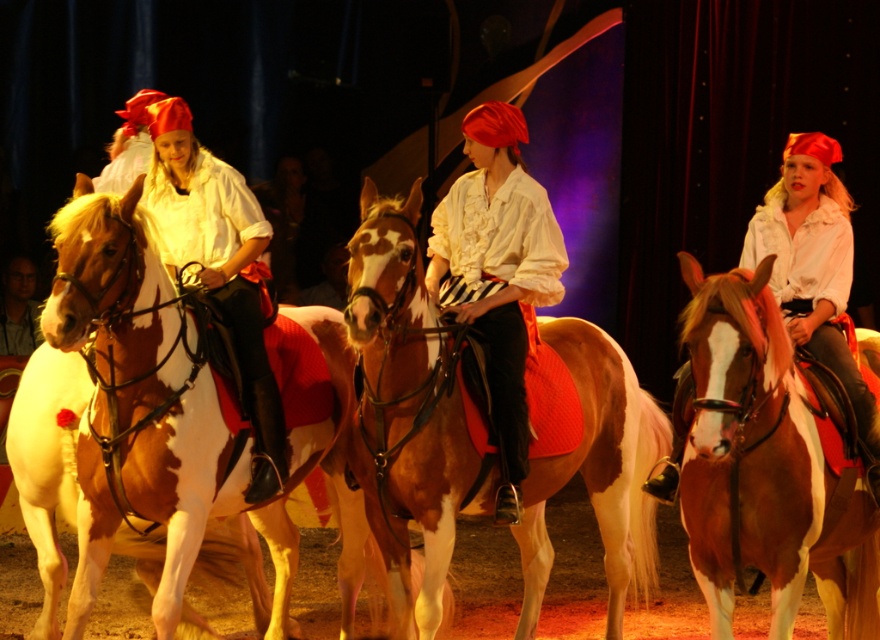
You are a stagehand observing the performance. You need to adjust the spotlight so it shines on the matte white shirt at center without illuminating the brown speckled horse at center. Based on their positions, is this possible?

The brown speckled horse at center is in front of the matte white shirt at center. Therefore, adjusting the spotlight to shine on the matte white shirt at center without illuminating the brown speckled horse at center would not be possible because the horse is blocking the direct line of light to the shirt.

You are a stagehand standing behind the dark curtains on the left side of the stage. You need to lead the brown and white speckled horse at center to the exit located behind the curtains. The horse is currently 3.98 meters away from you. Can you safely walk towards the horse without needing to move any other riders or horses first?

The brown and white speckled horse at center is 3.98 meters away from the viewer. Since you are a stagehand and the distance is sufficient, you can safely walk towards the horse without needing to move other riders or horses first.

You are designing a stable for the two horses in the image. The brown speckled horse at center and the brown glossy horse at center. Which horse requires a wider stall to accommodate its size?

The brown speckled horse at center requires a wider stall because its width is larger than the brown glossy horse at center.